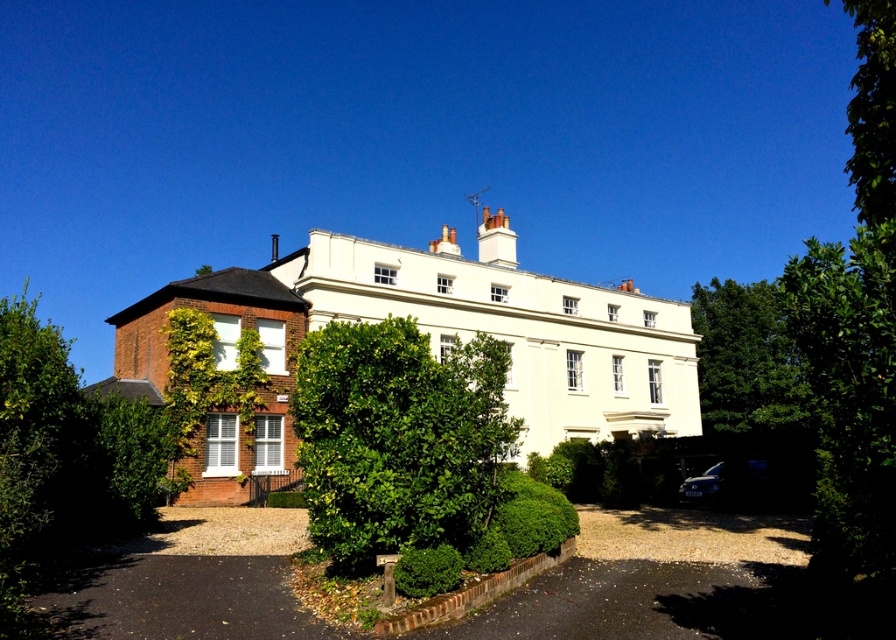
You are standing in front of the two story building and want to place a new decorative statue. The statue requires a spot that is not occupied by any green leafy bush. Based on the scene description, is the point at coordinates point (397, 436) suitable for placing the statue?

The point (397, 436) is marked as the location of the green leafy bush at center, so placing the statue there would interfere with the existing bush. Choose another spot without vegetation.

You are a landscape architect designing a garden layout. You have two plants to place in the front yard of the building shown. The green leafy bush at center and the green leafy tree at right must be positioned such that the smaller plant is closer to the building. Which plant should be placed closer to the building?

The green leafy bush at center is smaller than the green leafy tree at right, so the green leafy bush at center should be placed closer to the building.

You are a gardener who needs to trim plants in the garden. You have a ladder that can reach up to 3 meters. The green leafy bush at center and the green leafy tree at right are in your way. Which plant do you need the ladder for?

The green leafy tree at right is taller than the green leafy bush at center, so you need the ladder for the green leafy tree at right to reach its branches.